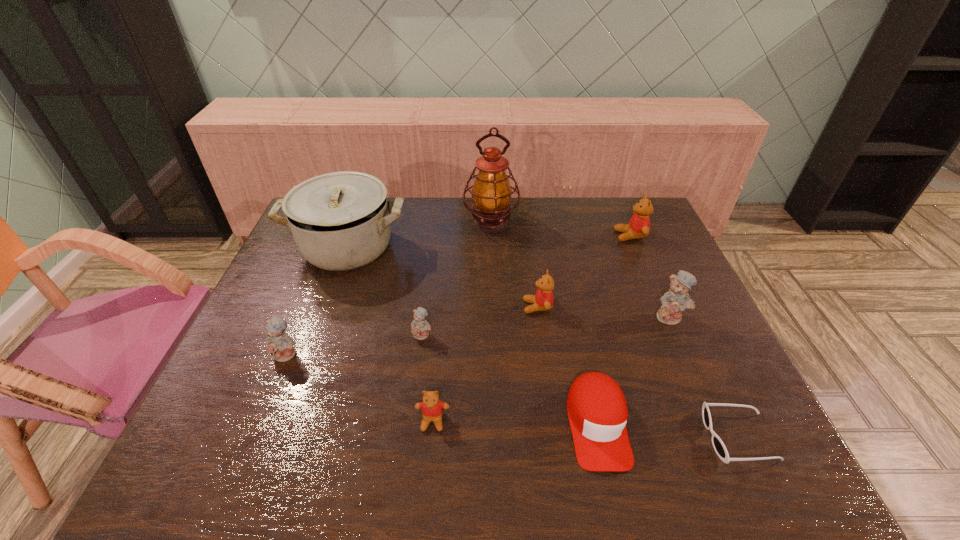
Identify the location of oil lamp. Image resolution: width=960 pixels, height=540 pixels. (491, 193).

Locate an element on the screen. The height and width of the screenshot is (540, 960). saucepan is located at coordinates (340, 221).

Locate an element on the screen. The height and width of the screenshot is (540, 960). white saucepan is located at coordinates (340, 221).

The height and width of the screenshot is (540, 960). I want to click on the rightmost blue teddy bear, so click(x=676, y=300).

Where is `the biggest blue teddy bear`? The height and width of the screenshot is (540, 960). the biggest blue teddy bear is located at coordinates (676, 300).

The width and height of the screenshot is (960, 540). Find the location of `the rightmost red teddy bear`. the rightmost red teddy bear is located at coordinates (638, 227).

Where is `the farthest red teddy bear`? This screenshot has height=540, width=960. the farthest red teddy bear is located at coordinates (638, 227).

This screenshot has height=540, width=960. I want to click on the second nearest red teddy bear, so click(543, 299).

This screenshot has height=540, width=960. I want to click on the second biggest red teddy bear, so click(543, 299).

This screenshot has height=540, width=960. Find the location of `the second nearest teddy bear`. the second nearest teddy bear is located at coordinates (278, 344).